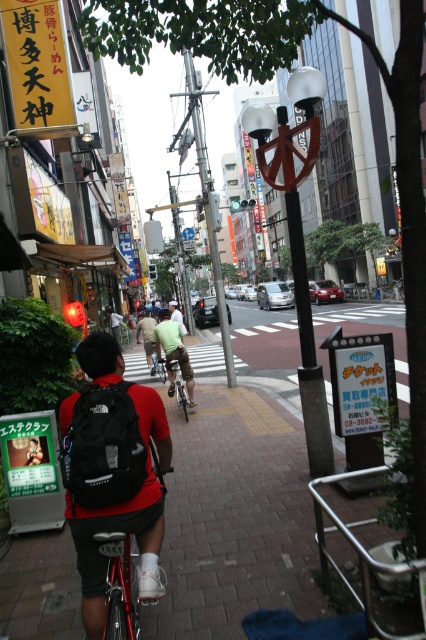
Is point (160, 497) closer to viewer compared to point (178, 400)?

Yes.

Who is lower down, matte black backpack at center or silver metallic bicycle at center?

Positioned lower is silver metallic bicycle at center.

The height and width of the screenshot is (640, 426). Describe the element at coordinates (112, 472) in the screenshot. I see `matte black backpack at center` at that location.

At what (x,y) coordinates should I click in order to perform the action: click on matte black backpack at center. Please return your answer as a coordinate pair (x, y). The height and width of the screenshot is (640, 426). Looking at the image, I should click on (112, 472).

Can you confirm if matte black backpack at center is positioned to the left of green fabric shirt at center?

In fact, matte black backpack at center is to the right of green fabric shirt at center.

Is matte black backpack at center positioned behind green fabric shirt at center?

No, it is not.

Which is behind, point (146, 422) or point (161, 346)?

Positioned behind is point (161, 346).

Find the location of a particular element. This screenshot has width=426, height=640. matte black backpack at center is located at coordinates (112, 472).

Which is more to the left, green fabric shirt at center or silver metallic bicycle at center?

green fabric shirt at center is more to the left.

Does green fabric shirt at center have a greater height compared to silver metallic bicycle at center?

Correct, green fabric shirt at center is much taller as silver metallic bicycle at center.

Describe the element at coordinates (173, 352) in the screenshot. I see `green fabric shirt at center` at that location.

Locate an element on the screen. green fabric shirt at center is located at coordinates [x=173, y=352].